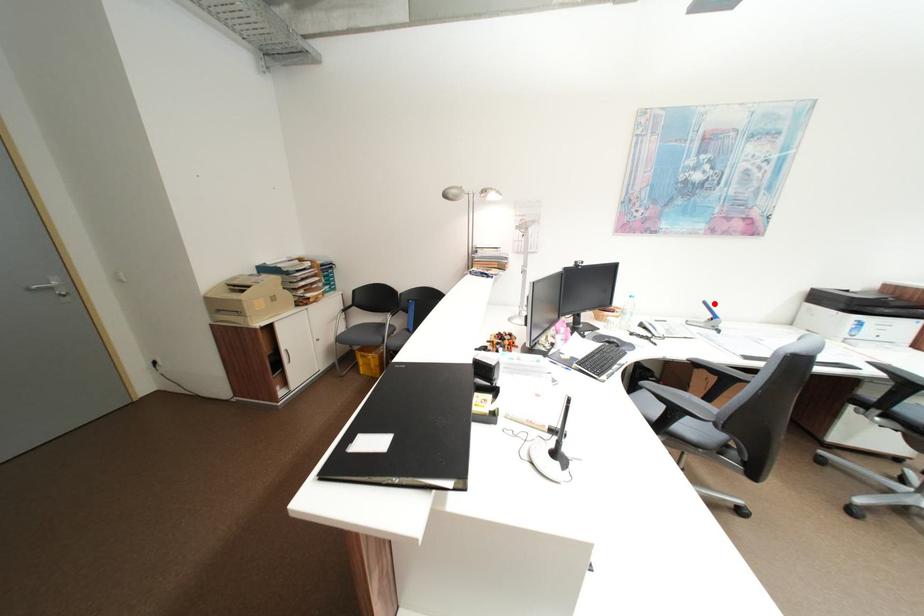
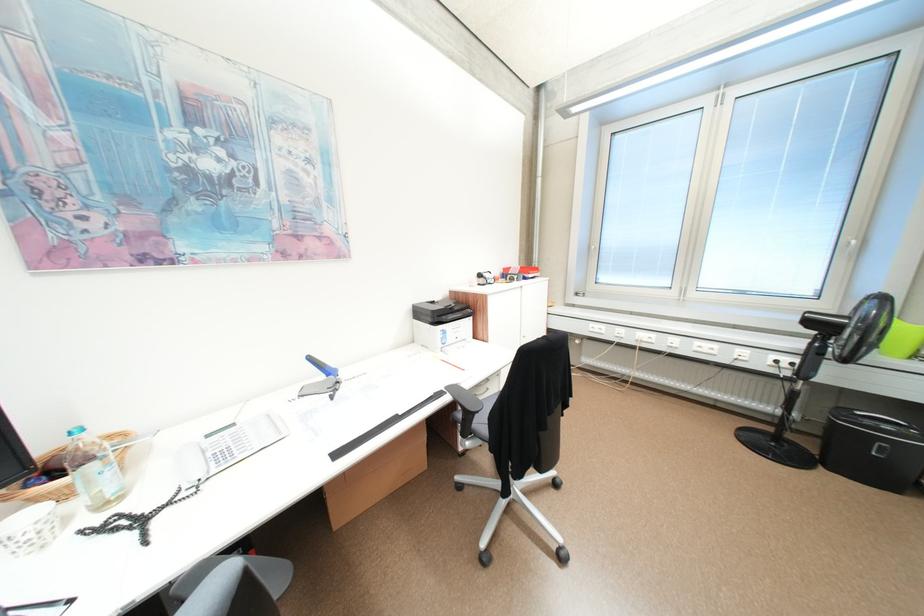
Where in the second image is the point corresponding to the highlighted location from the first image?

(320, 359)